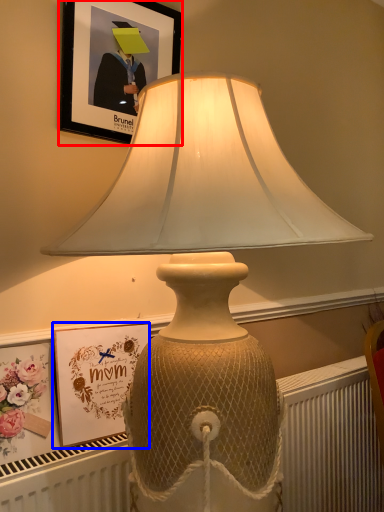
Question: Which point is closer to the camera, picture frame (highlighted by a red box) or picture frame (highlighted by a blue box)?

Choices:
 (A) picture frame
 (B) picture frame

Answer: (B)